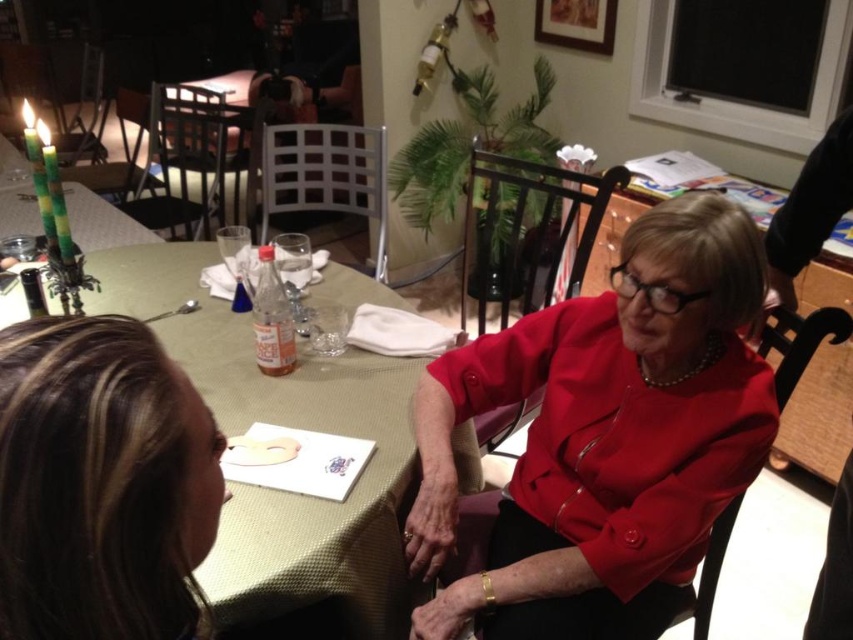
You are a photographer trying to capture a closeup of the brown hair at upper left and the green fabric table at center. Which object will require a wider angle lens to capture fully in the frame?

The green fabric table at center requires a wider angle lens because it occupies more space than the brown hair at upper left.

You are standing in the dining area and want to place a small decoration between the two points, point (721, 410) and point (160, 387). Which point is closer to you so that I can place the decoration appropriately?

Point (160, 387) is closer to you than point (721, 410), so place the decoration near point (160, 387).